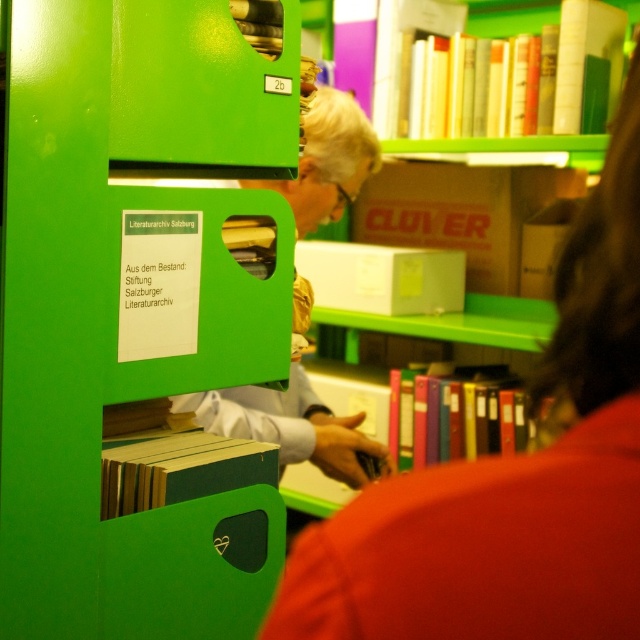
Question: Is matte gold glasses at upper center below green matte book at center?

Choices:
 (A) no
 (B) yes

Answer: (A)

Question: Which object appears closest to the camera in this image?

Choices:
 (A) multicolored plastic binders at center
 (B) matte gold glasses at upper center
 (C) cardboard box at center

Answer: (B)

Question: Is matte gold glasses at upper center bigger than green matte book at center?

Choices:
 (A) yes
 (B) no

Answer: (A)

Question: Which object appears farthest from the camera in this image?

Choices:
 (A) green matte book at center
 (B) multicolored plastic binders at center

Answer: (B)

Question: From the image, what is the correct spatial relationship of cardboard box at center in relation to hardcover book at upper center?

Choices:
 (A) right
 (B) left

Answer: (B)

Question: Estimate the real-world distances between objects in this image. Which object is closer to the multicolored plastic binders at center?

Choices:
 (A) cardboard box at center
 (B) hardcover book at upper center
 (C) green plastic bookcase at left
 (D) matte black laptop at upper center

Answer: (A)